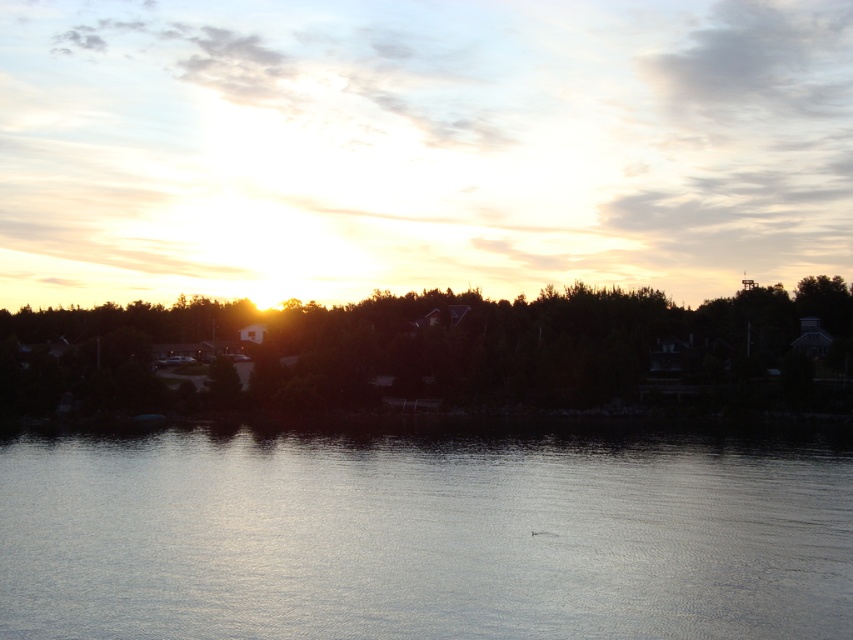
Is silvery reflective water at center wider than dark green leafy trees at center?

No, silvery reflective water at center is not wider than dark green leafy trees at center.

Which is more to the left, silvery reflective water at center or dark green leafy trees at center?

Positioned to the left is dark green leafy trees at center.

This screenshot has width=853, height=640. I want to click on silvery reflective water at center, so click(x=422, y=536).

Locate an element on the screen. This screenshot has width=853, height=640. silvery reflective water at center is located at coordinates (422, 536).